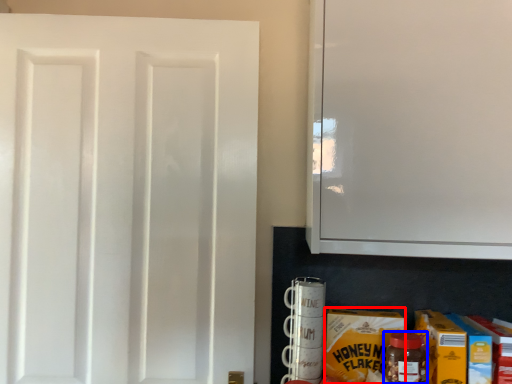
Question: Among these objects, which one is nearest to the camera, carton (highlighted by a red box) or bottle (highlighted by a blue box)?

Choices:
 (A) carton
 (B) bottle

Answer: (B)